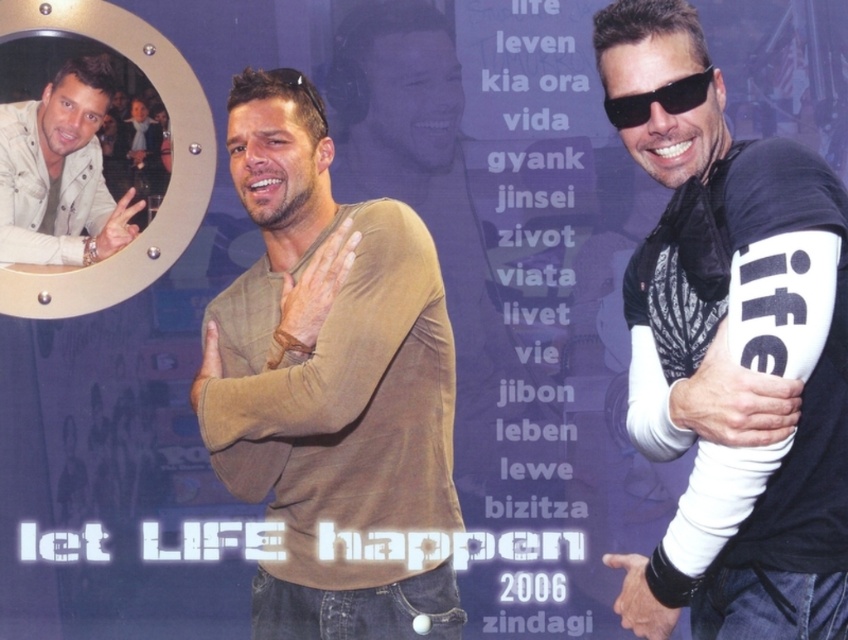
Which is above, brown matte long-sleeve shirt at center or black plastic goggles at center?

black plastic goggles at center

Is point (354, 348) farther from camera compared to point (289, 76)?

No, (354, 348) is in front of (289, 76).

Does point (272, 605) come closer to viewer compared to point (318, 113)?

Yes, point (272, 605) is closer to viewer.

Locate an element on the screen. The image size is (848, 640). brown matte long-sleeve shirt at center is located at coordinates (330, 381).

Is light beige denim jacket at upper left to the right of black plastic goggles at center from the viewer's perspective?

No, light beige denim jacket at upper left is not to the right of black plastic goggles at center.

Is point (10, 131) positioned before point (272, 76)?

No.

Which is in front, point (64, 205) or point (288, 80)?

Point (288, 80)

Find the location of `light beige denim jacket at upper left`. light beige denim jacket at upper left is located at coordinates (60, 172).

Who is shorter, black matte sunglasses at center or black plastic goggles at center?

With less height is black matte sunglasses at center.

Is point (681, 106) farther from viewer compared to point (325, 120)?

No, (681, 106) is closer to viewer.

The image size is (848, 640). Identify the location of black matte sunglasses at center. (657, 99).